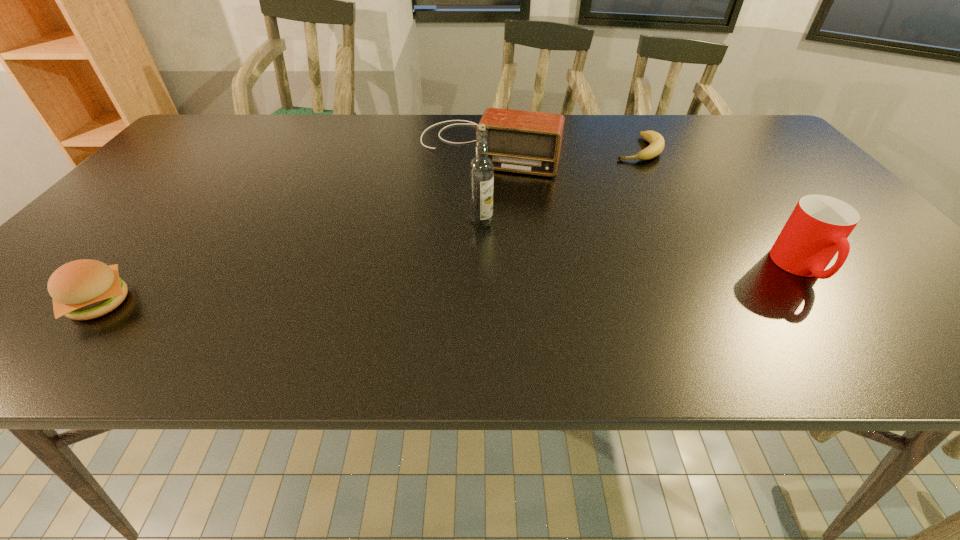
You are a GUI agent. You are given a task and a screenshot of the screen. Output one action in this format:
    pyautogui.click(x=<x>, y=<y>)
    Task: Click on the free spot on the desktop that is between the fourth tallest object and the rightmost object and is positioned on the front-facing side of the radio receiver
    This screenshot has height=540, width=960.
    Given the screenshot: What is the action you would take?
    pyautogui.click(x=425, y=286)

Image resolution: width=960 pixels, height=540 pixels. What are the coordinates of `free space on the desktop that is between the second shortest object and the cup and is positioned at the stem of the shortest object` in the screenshot? It's located at (545, 280).

The image size is (960, 540). I want to click on vacant space on the desktop that is between the hamburger and the rightmost object and is positioned on the label of the vodka, so click(497, 283).